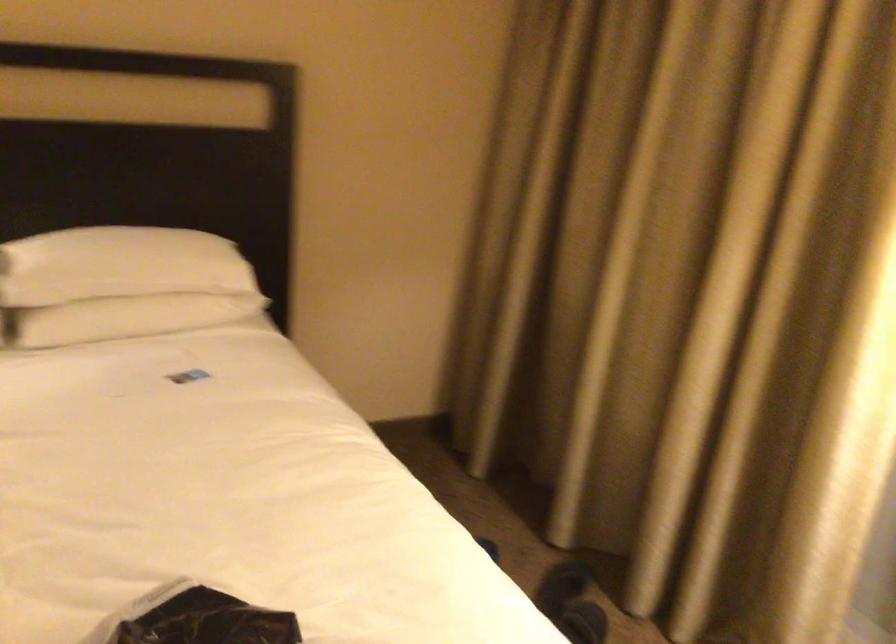
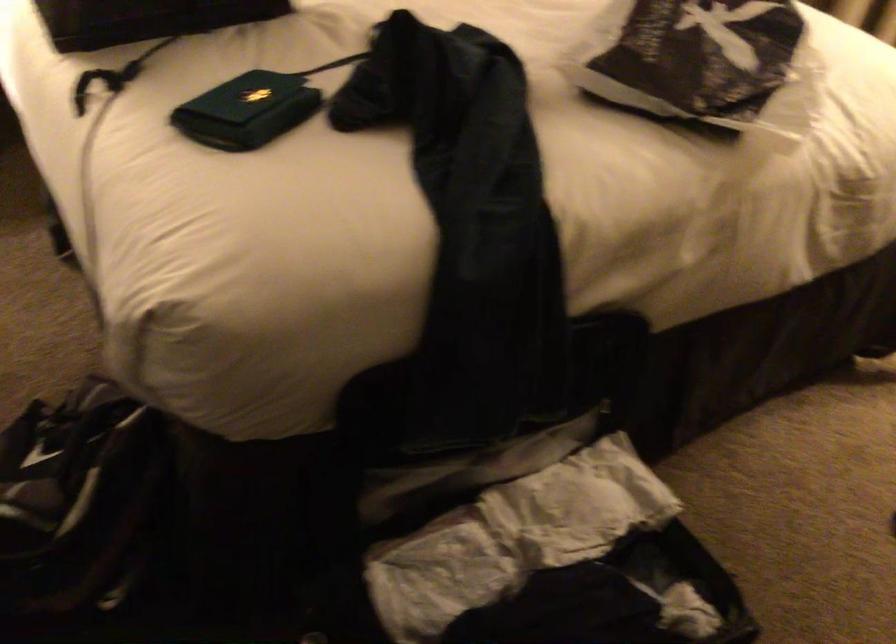
Question: The first image is from the beginning of the video and the second image is from the end. How did the camera likely rotate when shooting the video?

Choices:
 (A) Left
 (B) Right
 (C) Up
 (D) Down

Answer: (D)